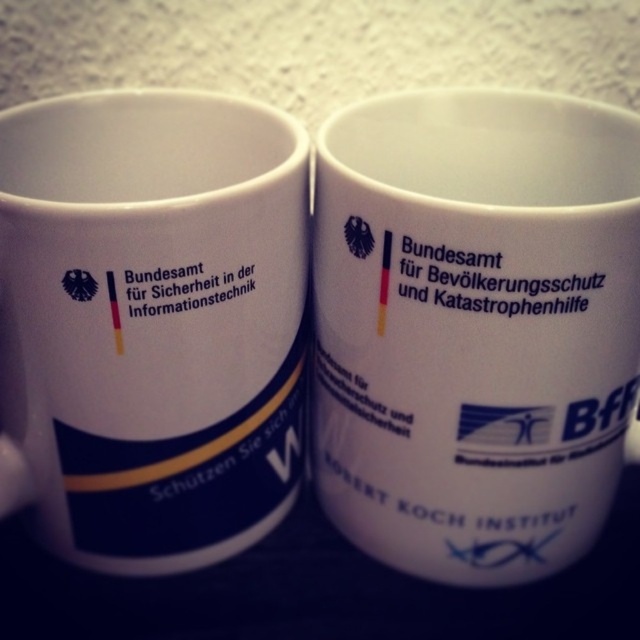
Is white ceramic mug at center shorter than white ceramic mug at left?

In fact, white ceramic mug at center may be taller than white ceramic mug at left.

Who is higher up, white ceramic mug at center or white ceramic mug at left?

white ceramic mug at center is higher up.

Is point (316, 355) positioned before point (49, 253)?

No, (316, 355) is behind (49, 253).

This screenshot has height=640, width=640. Identify the location of white ceramic mug at center. (474, 326).